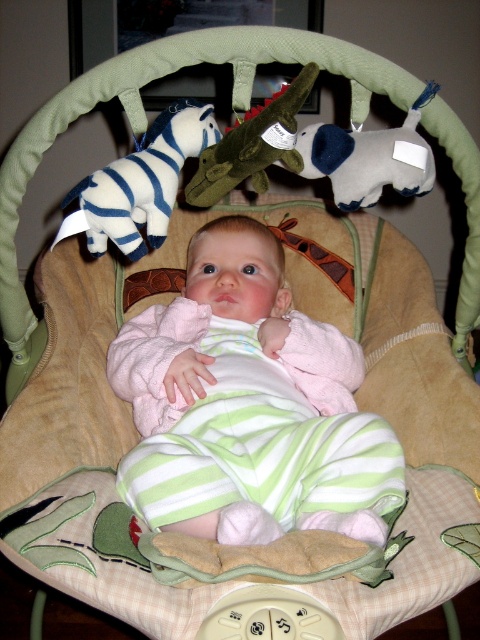
Does white plush zebra at upper left come in front of velvety green plush crocodile at center?

No, white plush zebra at upper left is further to the viewer.

Where is `white plush zebra at upper left`? Image resolution: width=480 pixels, height=640 pixels. white plush zebra at upper left is located at coordinates (140, 182).

Image resolution: width=480 pixels, height=640 pixels. Find the location of `white plush zebra at upper left`. white plush zebra at upper left is located at coordinates (140, 182).

Is white plush zebra at upper left bigger than felt elephant at center?

Indeed, white plush zebra at upper left has a larger size compared to felt elephant at center.

Who is more forward, (123, 212) or (410, 157)?

Point (123, 212) is more forward.

You are a GUI agent. You are given a task and a screenshot of the screen. Output one action in this format:
    pyautogui.click(x=<x>, y=<y>)
    Task: Click on the white plush zebra at upper left
    
    Given the screenshot: What is the action you would take?
    pyautogui.click(x=140, y=182)

Between point (277, 456) and point (253, 122), which one is positioned in front?

Point (253, 122) is more forward.

Can you confirm if pink fleece baby at center is positioned to the left of velvety green plush crocodile at center?

Yes, pink fleece baby at center is to the left of velvety green plush crocodile at center.

Is point (229, 349) farther from camera compared to point (228, 164)?

Yes, point (229, 349) is behind point (228, 164).

Find the location of a particular element. pink fleece baby at center is located at coordinates (248, 404).